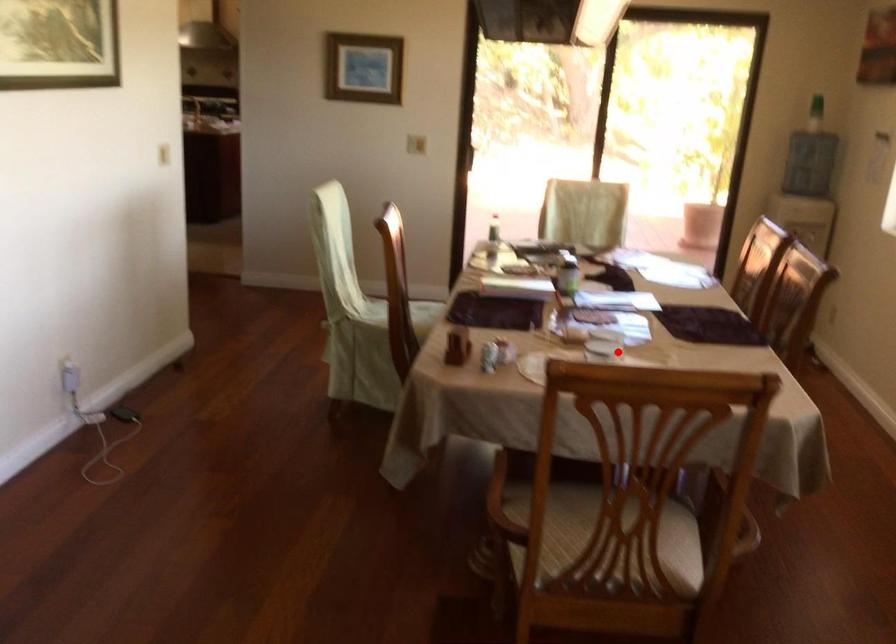
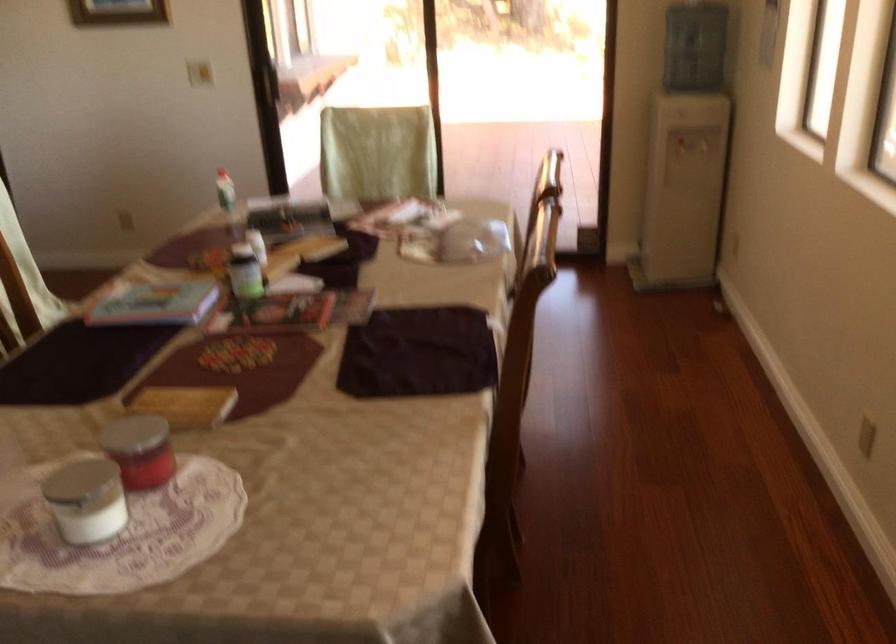
The point at the highlighted location is marked in the first image. Where is the corresponding point in the second image?

(162, 465)